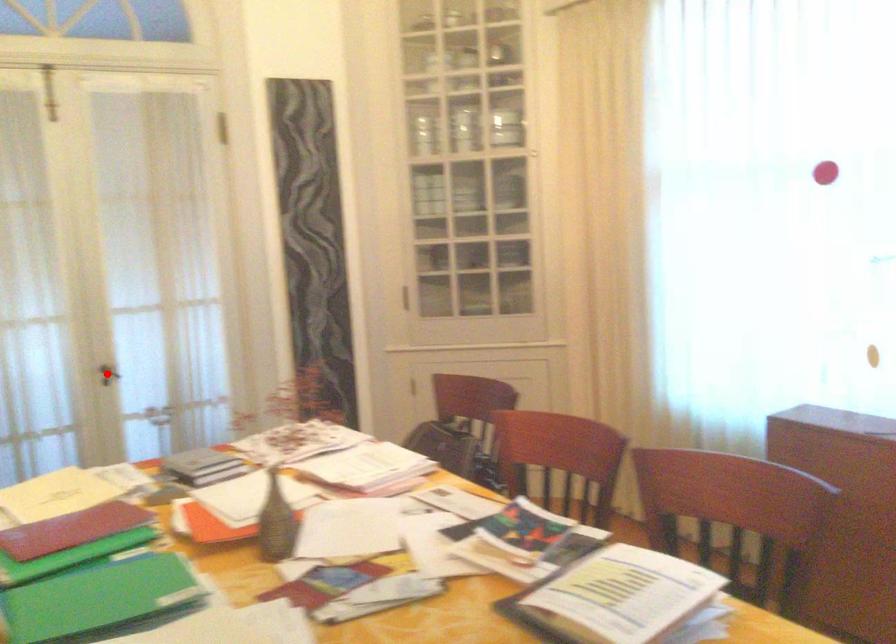
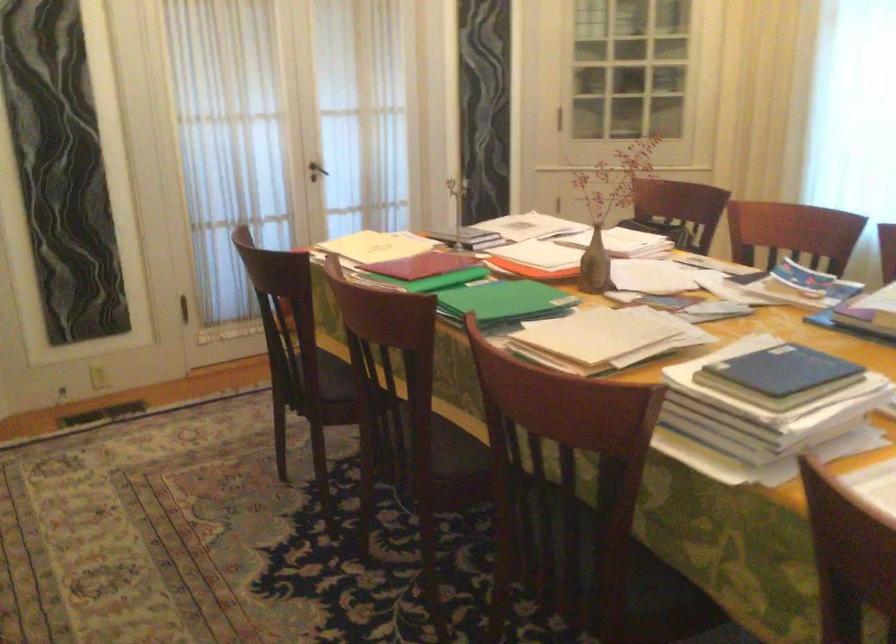
The point at the highlighted location is marked in the first image. Where is the corresponding point in the second image?

(316, 171)